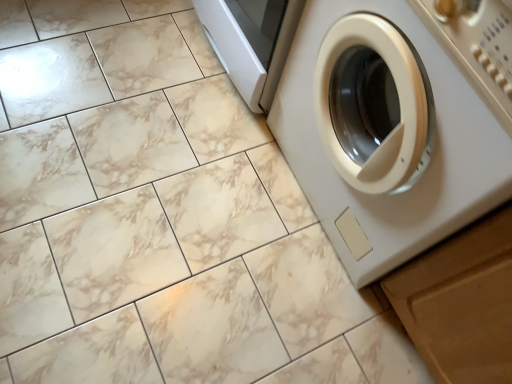
Locate an element on the screen. The height and width of the screenshot is (384, 512). wooden drawer at lower right is located at coordinates point(461,303).

What is the approximate width of wooden drawer at lower right?

The width of wooden drawer at lower right is 24.01 inches.

The height and width of the screenshot is (384, 512). What do you see at coordinates (461, 303) in the screenshot? I see `wooden drawer at lower right` at bounding box center [461, 303].

Describe the element at coordinates (385, 134) in the screenshot. I see `white glossy washing machine at right` at that location.

The height and width of the screenshot is (384, 512). I want to click on white glossy washing machine at right, so click(385, 134).

I want to click on wooden drawer at lower right, so click(x=461, y=303).

Considering the relative positions of white glossy washing machine at right and wooden drawer at lower right in the image provided, is white glossy washing machine at right to the right of wooden drawer at lower right from the viewer's perspective?

In fact, white glossy washing machine at right is to the left of wooden drawer at lower right.

Is white glossy washing machine at right positioned before wooden drawer at lower right?

That is True.

Considering the points (354, 195) and (472, 340), which point is behind, point (354, 195) or point (472, 340)?

The point (354, 195) is farther.

From the image's perspective, is white glossy washing machine at right under wooden drawer at lower right?

No.

From a real-world perspective, is white glossy washing machine at right located higher than wooden drawer at lower right?

Indeed, from a real-world perspective, white glossy washing machine at right stands above wooden drawer at lower right.

Considering the sizes of objects white glossy washing machine at right and wooden drawer at lower right in the image provided, who is wider, white glossy washing machine at right or wooden drawer at lower right?

white glossy washing machine at right.

Who is shorter, white glossy washing machine at right or wooden drawer at lower right?

With less height is wooden drawer at lower right.

Considering the sizes of objects white glossy washing machine at right and wooden drawer at lower right in the image provided, who is smaller, white glossy washing machine at right or wooden drawer at lower right?

Smaller between the two is wooden drawer at lower right.

Is wooden drawer at lower right surrounded by white glossy washing machine at right?

That's incorrect, wooden drawer at lower right is not inside white glossy washing machine at right.

Is white glossy washing machine at right not close to wooden drawer at lower right?

No, white glossy washing machine at right is not far from wooden drawer at lower right.

Is white glossy washing machine at right oriented towards wooden drawer at lower right?

No, white glossy washing machine at right is not oriented towards wooden drawer at lower right.

What's the angular difference between white glossy washing machine at right and wooden drawer at lower right's facing directions?

The angle between the facing direction of white glossy washing machine at right and the facing direction of wooden drawer at lower right is 0.117 degrees.

Measure the distance between white glossy washing machine at right and wooden drawer at lower right.

white glossy washing machine at right is 22.20 centimeters away from wooden drawer at lower right.

The height and width of the screenshot is (384, 512). I want to click on washing machine on the left of wooden drawer at lower right, so click(x=385, y=134).

Considering the relative positions of wooden drawer at lower right and white glossy washing machine at right in the image provided, is wooden drawer at lower right to the left of white glossy washing machine at right from the viewer's perspective?

No.

Which object is further away from the camera taking this photo, wooden drawer at lower right or white glossy washing machine at right?

wooden drawer at lower right is more distant.

Considering the positions of point (502, 283) and point (370, 81), is point (502, 283) closer or farther from the camera than point (370, 81)?

Point (502, 283) is closer to the camera than point (370, 81).

From the image's perspective, would you say wooden drawer at lower right is positioned over white glossy washing machine at right?

No, from the image's perspective, wooden drawer at lower right is not above white glossy washing machine at right.

From a real-world perspective, is wooden drawer at lower right positioned under white glossy washing machine at right based on gravity?

Yes, from a real-world perspective, wooden drawer at lower right is under white glossy washing machine at right.

Can you confirm if wooden drawer at lower right is wider than white glossy washing machine at right?

Incorrect, the width of wooden drawer at lower right does not surpass that of white glossy washing machine at right.

Does wooden drawer at lower right have a lesser height compared to white glossy washing machine at right?

Correct, wooden drawer at lower right is not as tall as white glossy washing machine at right.

In terms of size, does wooden drawer at lower right appear bigger or smaller than white glossy washing machine at right?

In the image, wooden drawer at lower right appears to be smaller than white glossy washing machine at right.

Would you say wooden drawer at lower right contains white glossy washing machine at right?

No, white glossy washing machine at right is not inside wooden drawer at lower right.

Are wooden drawer at lower right and white glossy washing machine at right located far from each other?

No, wooden drawer at lower right is in close proximity to white glossy washing machine at right.

Is wooden drawer at lower right facing away from white glossy washing machine at right?

wooden drawer at lower right is not turned away from white glossy washing machine at right.

Can you tell me how much wooden drawer at lower right and white glossy washing machine at right differ in facing direction?

They differ by 0.117 degrees in their facing directions.

Consider the image. Measure the distance from wooden drawer at lower right to white glossy washing machine at right.

A distance of 8.74 inches exists between wooden drawer at lower right and white glossy washing machine at right.

Where is `drawer behind the white glossy washing machine at right`? This screenshot has height=384, width=512. drawer behind the white glossy washing machine at right is located at coordinates (461, 303).

Identify the location of washing machine that is above the wooden drawer at lower right (from the image's perspective). This screenshot has width=512, height=384. (385, 134).

You are a GUI agent. You are given a task and a screenshot of the screen. Output one action in this format:
    pyautogui.click(x=<x>, y=<y>)
    Task: Click on the drawer behind the white glossy washing machine at right
    This screenshot has height=384, width=512.
    Given the screenshot: What is the action you would take?
    pyautogui.click(x=461, y=303)